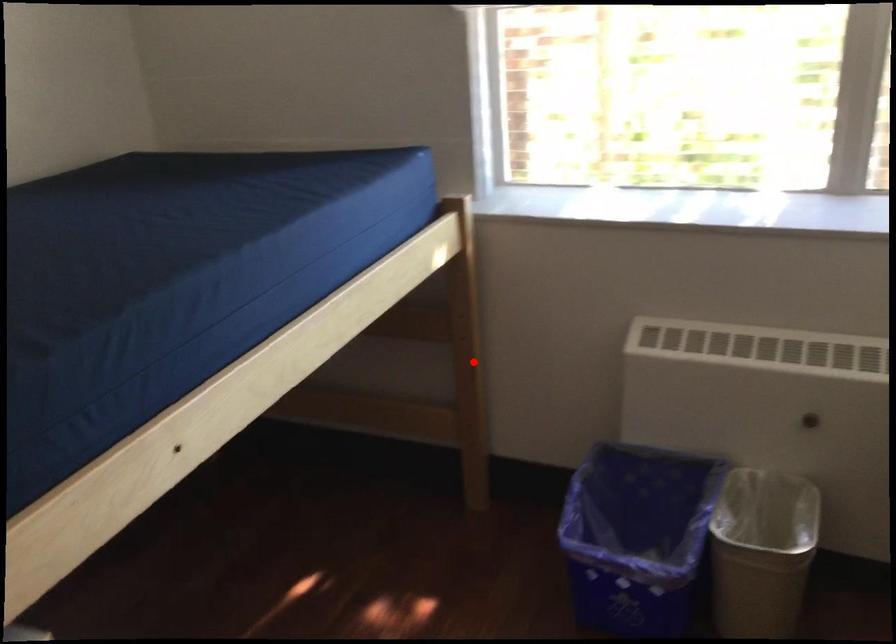
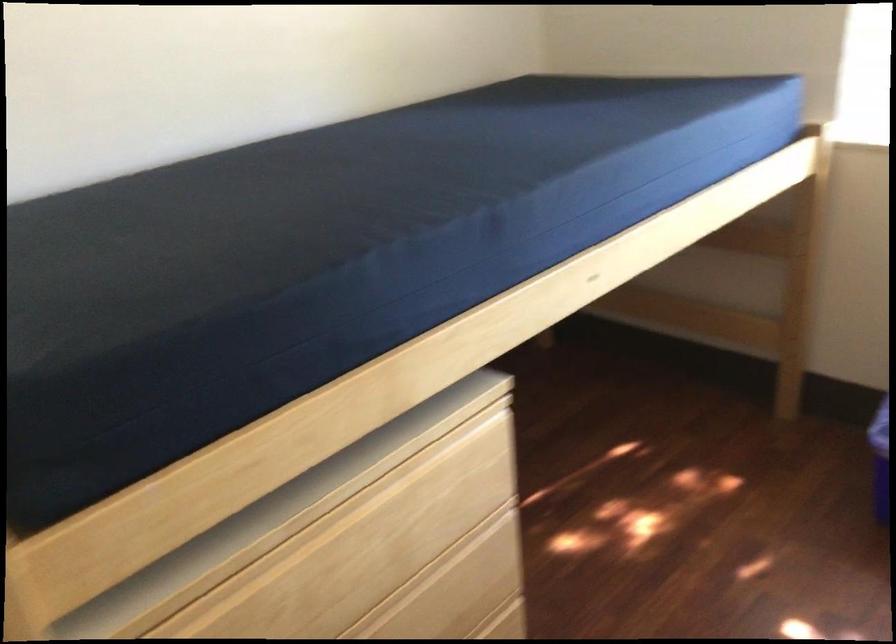
Where in the second image is the point corresponding to the highlighted location from the first image?

(803, 275)